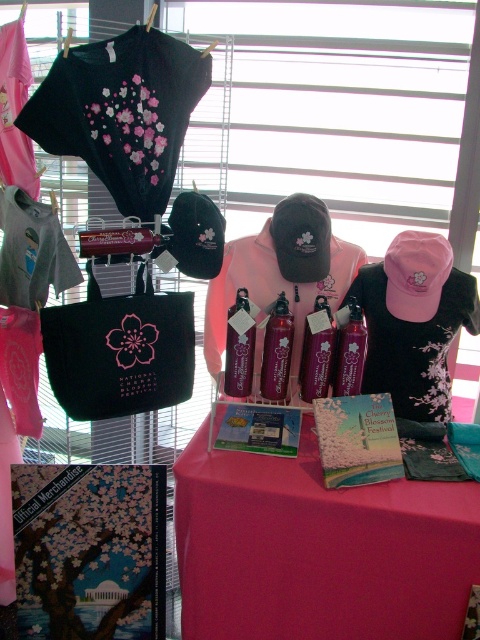
Question: Which object is the closest to the pink fabric dress at center?

Choices:
 (A) matte black t-shirt with pink blossoms at upper left
 (B) translucent pink spray bottle at center

Answer: (B)

Question: Can you confirm if pink fabric tablecloth at center is wider than shiny purple bottle at center?

Choices:
 (A) no
 (B) yes

Answer: (B)

Question: Can you confirm if shiny purple bottle at center is positioned to the right of translucent pink spray bottle at center?

Choices:
 (A) no
 (B) yes

Answer: (B)

Question: Which is farther from the shiny purple bottle at center?

Choices:
 (A) matte black t-shirt with pink blossoms at upper left
 (B) pink fabric tablecloth at center
 (C) pink fabric dress at center

Answer: (A)

Question: Which object is positioned closest to the pink fabric tablecloth at center?

Choices:
 (A) pink fabric dress at center
 (B) pink glossy spray bottle at center

Answer: (B)

Question: Does pink fabric tablecloth at center have a smaller size compared to shiny purple bottle at center?

Choices:
 (A) yes
 (B) no

Answer: (B)